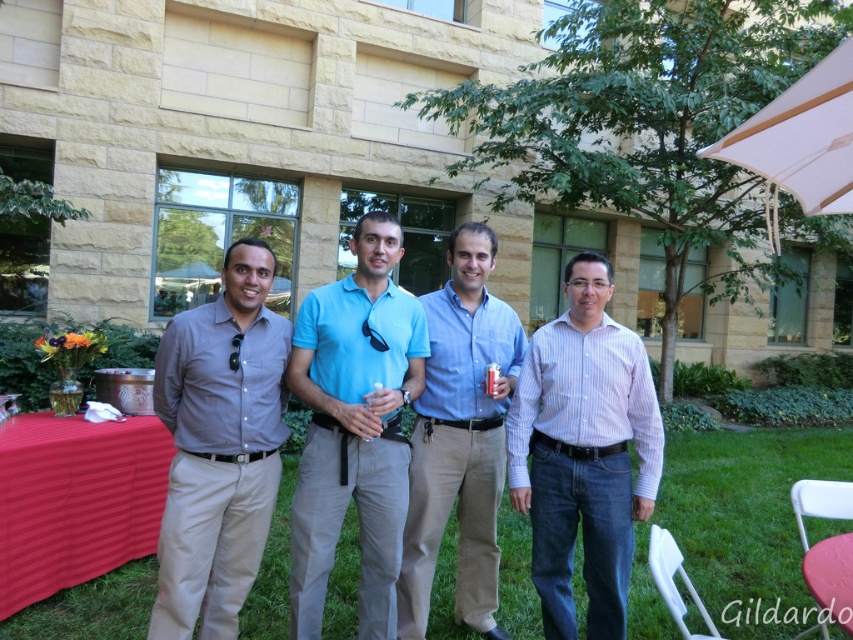
Question: Does matte gray shirt at center appear under light blue polo shirt at center?

Choices:
 (A) yes
 (B) no

Answer: (A)

Question: Estimate the real-world distances between objects in this image. Which object is closer to the red fabric tablecloth at lower left?

Choices:
 (A) black satin tie at center
 (B) striped cotton shirt at center

Answer: (A)

Question: Which point is farther to the camera?

Choices:
 (A) (708, 550)
 (B) (16, 420)
 (C) (466, 604)

Answer: (A)

Question: Which object is farther from the camera taking this photo?

Choices:
 (A) blue cotton shirt at center
 (B) green grass at lower center
 (C) red fabric tablecloth at lower left
 (D) white fabric umbrella at upper right

Answer: (B)

Question: Is green grass at lower center to the left of white fabric umbrella at upper right from the viewer's perspective?

Choices:
 (A) yes
 (B) no

Answer: (B)

Question: Does green grass at lower center come behind blue cotton shirt at center?

Choices:
 (A) no
 (B) yes

Answer: (B)